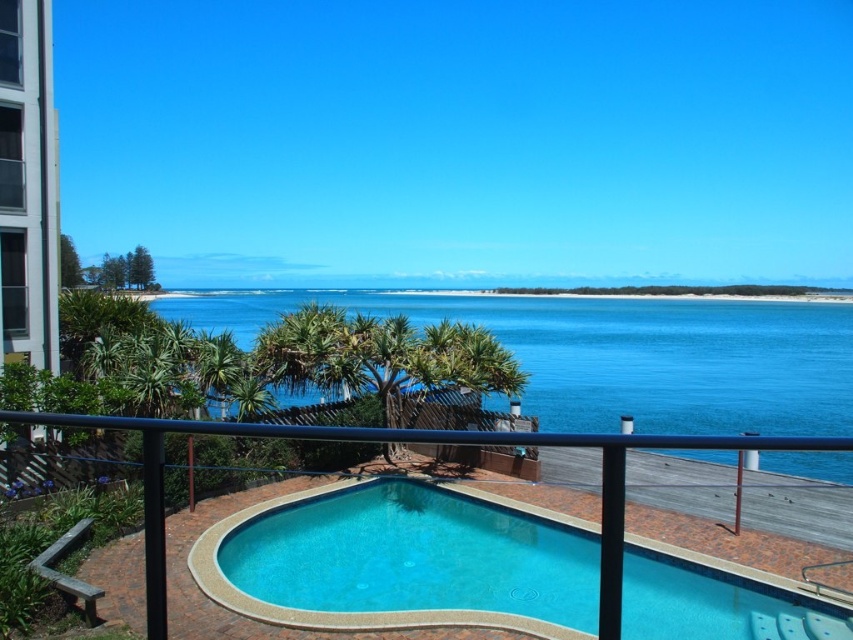
Question: Which point is closer to the camera?

Choices:
 (A) blue water at center
 (B) smooth concrete pool at center

Answer: (A)

Question: Which point appears closest to the camera in this image?

Choices:
 (A) (734, 358)
 (B) (436, 516)

Answer: (B)

Question: Can you confirm if smooth concrete pool at center is positioned above blue water at center?

Choices:
 (A) no
 (B) yes

Answer: (A)

Question: Is smooth concrete pool at center above blue water at center?

Choices:
 (A) no
 (B) yes

Answer: (A)

Question: Does smooth concrete pool at center have a lesser width compared to blue water at center?

Choices:
 (A) no
 (B) yes

Answer: (B)